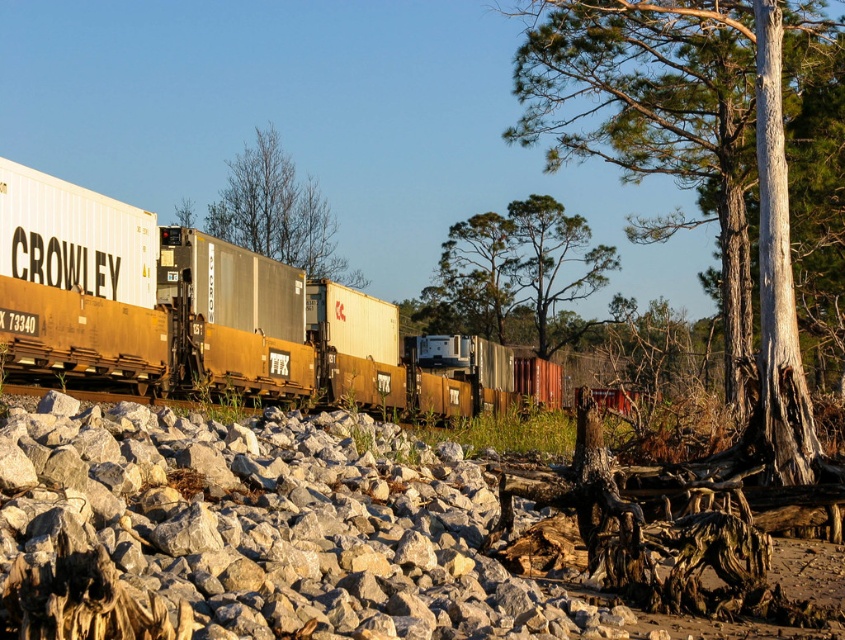
Is point (53, 314) behind point (315, 221)?

No, (53, 314) is closer to viewer.

Does rusty metal train car at center have a lesser height compared to bare branches at center?

Indeed, rusty metal train car at center has a lesser height compared to bare branches at center.

Which is behind, point (372, 305) or point (222, 198)?

The point (222, 198) is behind.

I want to click on rusty metal train car at center, so click(x=189, y=310).

Which of these two, rusty metal train car at center or green leafy tree at center, stands taller?

With more height is green leafy tree at center.

Who is more distant from viewer, (80, 196) or (466, 300)?

The point (466, 300) is more distant.

Identify the location of rusty metal train car at center. (189, 310).

Can you confirm if smooth gray bark at center right is bigger than bare branches at center?

Actually, smooth gray bark at center right might be smaller than bare branches at center.

Is point (745, 241) closer to camera compared to point (232, 230)?

Yes.

Who is more distant from viewer, (766, 129) or (298, 180)?

The point (298, 180) is behind.

The image size is (845, 640). I want to click on smooth gray bark at center right, so click(684, 148).